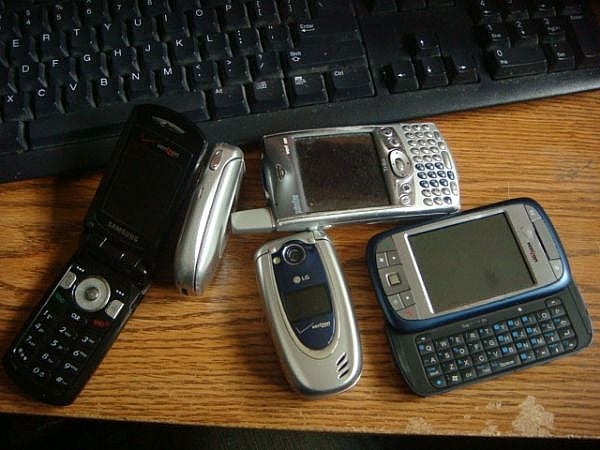
This screenshot has height=450, width=600. What are the coordinates of `keyboard` in the screenshot? It's located at (431, 160), (499, 348), (179, 53).